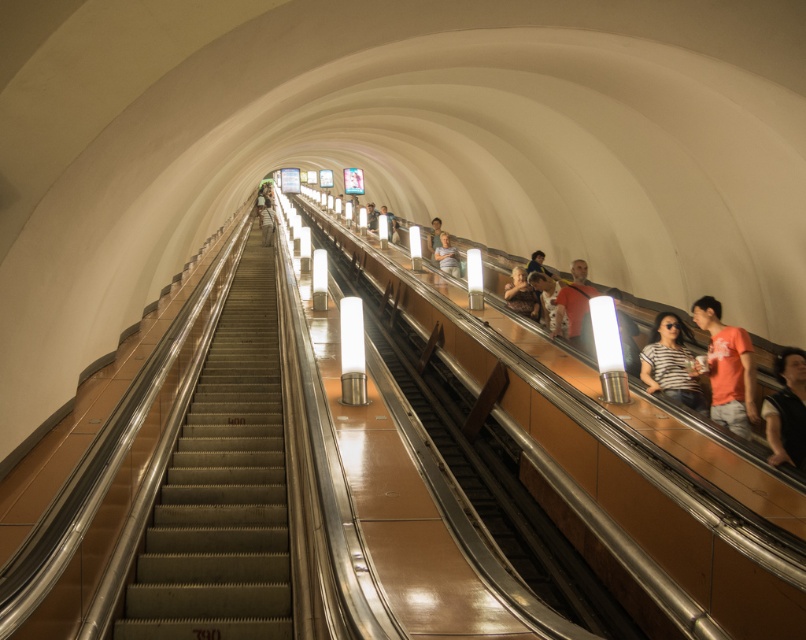
Does dark brown leather jacket at right have a greater height compared to light brown leather jacket at upper center?

Yes.

Is dark brown leather jacket at right below light brown leather jacket at upper center?

Correct, dark brown leather jacket at right is located below light brown leather jacket at upper center.

Is point (800, 380) positioned before point (437, 244)?

That is True.

At what (x,y) coordinates should I click in order to perform the action: click on dark brown leather jacket at right. Please return your answer as a coordinate pair (x, y). The image size is (806, 640). Looking at the image, I should click on (787, 410).

Is orange cotton t-shirt at right further to camera compared to light brown leather jacket at upper right?

No, orange cotton t-shirt at right is in front of light brown leather jacket at upper right.

Is point (738, 404) in front of point (588, 300)?

Yes.

The height and width of the screenshot is (640, 806). What do you see at coordinates (726, 369) in the screenshot?
I see `orange cotton t-shirt at right` at bounding box center [726, 369].

Locate an element on the screen. This screenshot has height=640, width=806. orange cotton t-shirt at right is located at coordinates (726, 369).

Based on the photo, can you confirm if dark brown leather jacket at right is smaller than smooth beige shirt at center?

Correct, dark brown leather jacket at right occupies less space than smooth beige shirt at center.

Who is higher up, dark brown leather jacket at right or smooth beige shirt at center?

smooth beige shirt at center is higher up.

The width and height of the screenshot is (806, 640). What do you see at coordinates (787, 410) in the screenshot?
I see `dark brown leather jacket at right` at bounding box center [787, 410].

The height and width of the screenshot is (640, 806). Find the location of `dark brown leather jacket at right`. dark brown leather jacket at right is located at coordinates (787, 410).